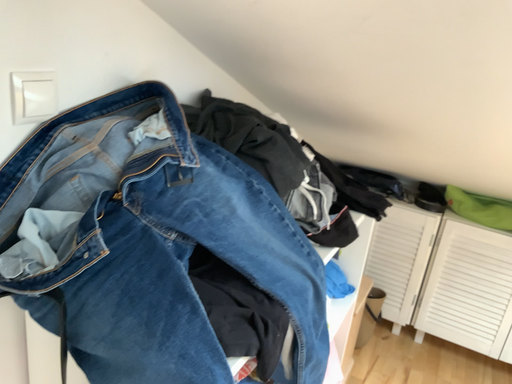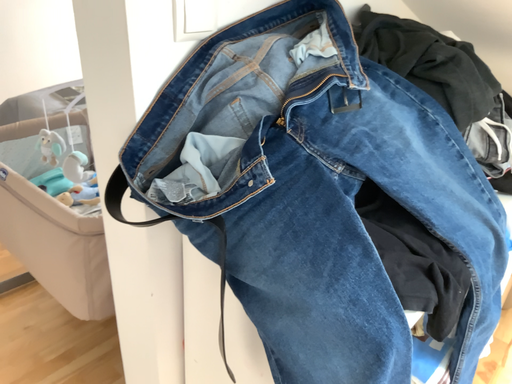
Question: How did the camera likely rotate when shooting the video?

Choices:
 (A) rotated downward
 (B) rotated upward

Answer: (A)